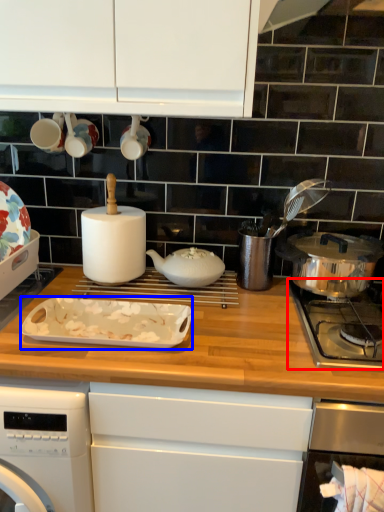
Question: Which object is further to the camera taking this photo, gas stove (highlighted by a red box) or kitchen appliance (highlighted by a blue box)?

Choices:
 (A) gas stove
 (B) kitchen appliance

Answer: (B)